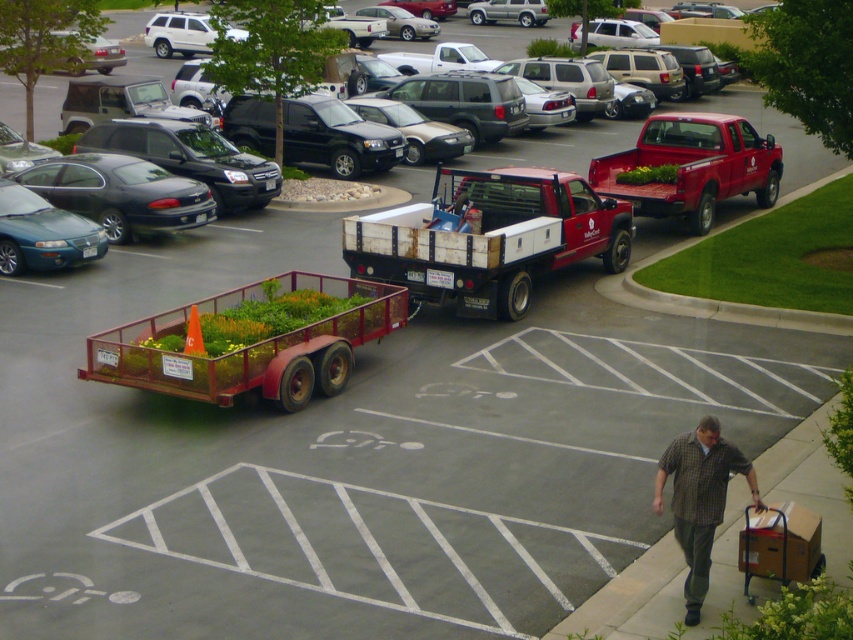
Question: Is metallic red trailer at center thinner than matte red pickup truck at right?

Choices:
 (A) no
 (B) yes

Answer: (A)

Question: Which object is the closest to the red matte truck at center?

Choices:
 (A) matte red pickup truck at right
 (B) matte white truck at center
 (C) plaid shirt at lower right

Answer: (A)

Question: Does red matte truck at center have a smaller size compared to teal glossy sedan at left?

Choices:
 (A) no
 (B) yes

Answer: (A)

Question: Is matte red pickup truck at right smaller than matte black sedan at left?

Choices:
 (A) yes
 (B) no

Answer: (A)

Question: Which point is closer to the camera?

Choices:
 (A) (401, 326)
 (B) (73, 244)

Answer: (A)

Question: Which of the following is the farthest from the observer?

Choices:
 (A) 544,148
 (B) 151,364
 (C) 473,218

Answer: (A)